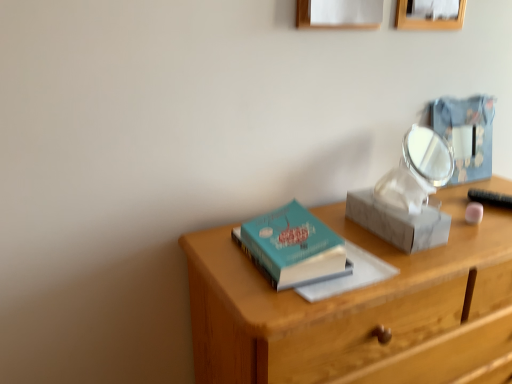
Identify the location of spots to the right of metallic blue box at upper right. (493, 182).